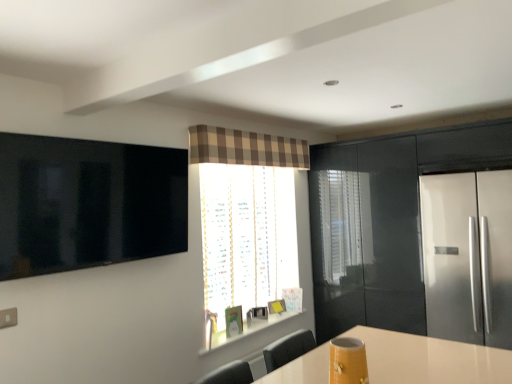
Question: Is glossy black cabinet at right located outside brown plaid curtain at upper center?

Choices:
 (A) no
 (B) yes

Answer: (B)

Question: From a real-world perspective, is glossy black cabinet at right positioned under brown plaid curtain at upper center based on gravity?

Choices:
 (A) yes
 (B) no

Answer: (A)

Question: Can you confirm if glossy black cabinet at right is shorter than brown plaid curtain at upper center?

Choices:
 (A) yes
 (B) no

Answer: (B)

Question: From the image's perspective, does glossy black cabinet at right appear lower than brown plaid curtain at upper center?

Choices:
 (A) yes
 (B) no

Answer: (A)

Question: Could you tell me if glossy black cabinet at right is turned towards brown plaid curtain at upper center?

Choices:
 (A) no
 (B) yes

Answer: (B)

Question: Considering the positions of satin silver fridge at right and matte yellow vase at lower center in the image, is satin silver fridge at right bigger or smaller than matte yellow vase at lower center?

Choices:
 (A) big
 (B) small

Answer: (A)

Question: From a real-world perspective, relative to matte yellow vase at lower center, is satin silver fridge at right vertically above or below?

Choices:
 (A) above
 (B) below

Answer: (A)

Question: Considering the positions of point (424, 238) and point (348, 359), is point (424, 238) closer or farther from the camera than point (348, 359)?

Choices:
 (A) closer
 (B) farther

Answer: (B)

Question: Is satin silver fridge at right taller or shorter than matte yellow vase at lower center?

Choices:
 (A) tall
 (B) short

Answer: (A)

Question: From the image's perspective, is matte yellow vase at lower center above or below translucent fabric window at center?

Choices:
 (A) below
 (B) above

Answer: (A)

Question: In terms of height, does matte yellow vase at lower center look taller or shorter compared to translucent fabric window at center?

Choices:
 (A) short
 (B) tall

Answer: (A)

Question: Is point tap(353, 370) positioned closer to the camera than point tap(259, 160)?

Choices:
 (A) closer
 (B) farther

Answer: (A)

Question: From a real-world perspective, is matte yellow vase at lower center physically located above or below translucent fabric window at center?

Choices:
 (A) above
 (B) below

Answer: (B)

Question: From a real-world perspective, is matte yellow vase at lower center above or below glossy black cabinet at right?

Choices:
 (A) below
 (B) above

Answer: (A)

Question: Considering the positions of matte yellow vase at lower center and glossy black cabinet at right in the image, is matte yellow vase at lower center taller or shorter than glossy black cabinet at right?

Choices:
 (A) tall
 (B) short

Answer: (B)